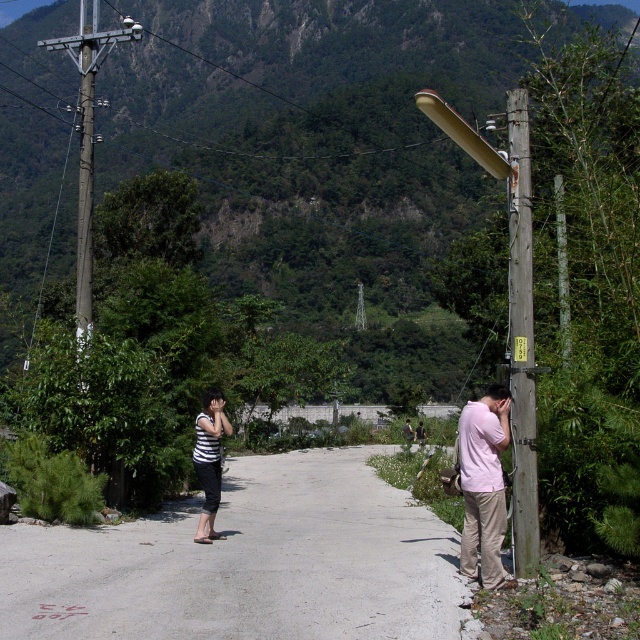
Question: Which object is farther from the camera taking this photo?

Choices:
 (A) striped fabric shirt at center
 (B) light pink cotton shirt at right
 (C) pink matte shirt at right
 (D) gray concrete road at center

Answer: (B)

Question: Can you confirm if wooden utility pole at right is wider than striped fabric shirt at center?

Choices:
 (A) yes
 (B) no

Answer: (A)

Question: Which of the following is the closest to the observer?

Choices:
 (A) (506, 404)
 (B) (529, 352)

Answer: (A)

Question: Can you confirm if wooden utility pole at right is positioned to the right of light pink cotton shirt at right?

Choices:
 (A) yes
 (B) no

Answer: (B)

Question: Based on their relative distances, which object is nearer to the gray concrete road at center?

Choices:
 (A) pink matte shirt at right
 (B) striped fabric shirt at center

Answer: (B)

Question: Is gray concrete road at center thinner than light pink cotton shirt at right?

Choices:
 (A) no
 (B) yes

Answer: (A)